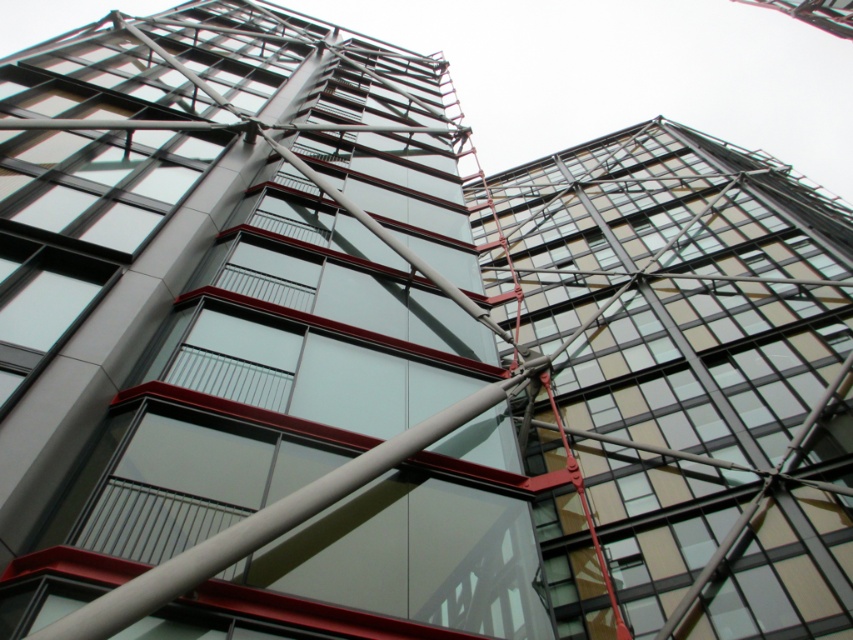
Question: Which object appears closest to the camera in this image?

Choices:
 (A) glassy steel tower at center
 (B) transparent glass building at upper right

Answer: (A)

Question: Is glassy steel tower at center positioned behind transparent glass building at upper right?

Choices:
 (A) yes
 (B) no

Answer: (B)

Question: Which point is farther from the camera taking this photo?

Choices:
 (A) pyautogui.click(x=561, y=529)
 (B) pyautogui.click(x=207, y=509)

Answer: (A)

Question: Which of the following is the farthest from the observer?

Choices:
 (A) (706, 374)
 (B) (55, 253)

Answer: (A)

Question: Observing the image, what is the correct spatial positioning of glassy steel tower at center in reference to transparent glass building at upper right?

Choices:
 (A) left
 (B) right

Answer: (A)

Question: Can you confirm if glassy steel tower at center is positioned to the left of transparent glass building at upper right?

Choices:
 (A) no
 (B) yes

Answer: (B)